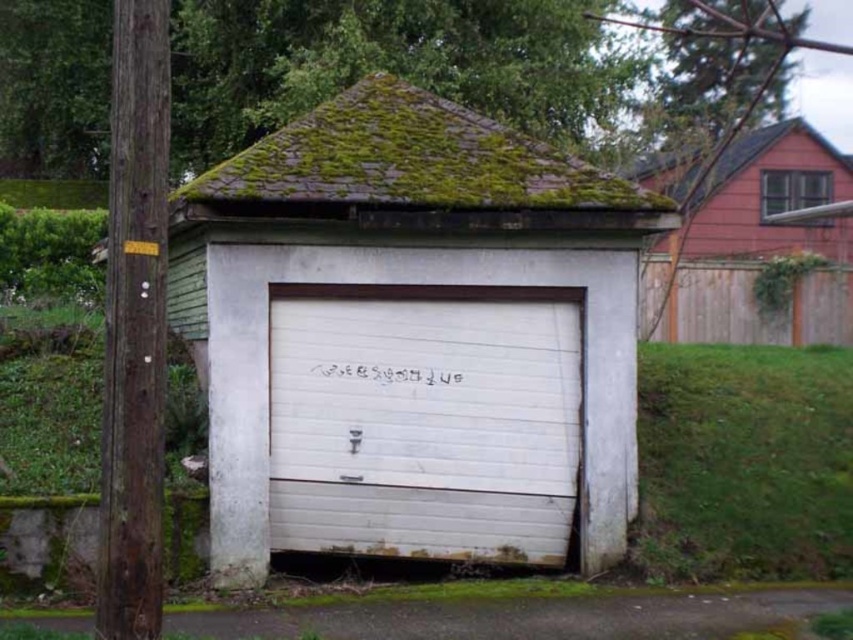
Question: Is white painted wood garage door at center below red wood fence at upper right?

Choices:
 (A) yes
 (B) no

Answer: (A)

Question: Which object is positioned farthest from the white painted wood garage door at center?

Choices:
 (A) weathered brown wood at left
 (B) red wood fence at upper right
 (C) green mossy shingles at upper center

Answer: (B)

Question: Can you confirm if white matte garage door at center is positioned to the left of red wood fence at upper right?

Choices:
 (A) yes
 (B) no

Answer: (A)

Question: Is weathered brown wood at left above red wood fence at upper right?

Choices:
 (A) no
 (B) yes

Answer: (A)

Question: Among these objects, which one is nearest to the camera?

Choices:
 (A) green mossy shingles at upper center
 (B) white matte garage door at center
 (C) white painted wood garage door at center
 (D) weathered brown wood at left

Answer: (D)

Question: Which object is positioned farthest from the white matte garage door at center?

Choices:
 (A) weathered brown wood at left
 (B) white painted wood garage door at center
 (C) green mossy shingles at upper center
 (D) red wood fence at upper right

Answer: (D)